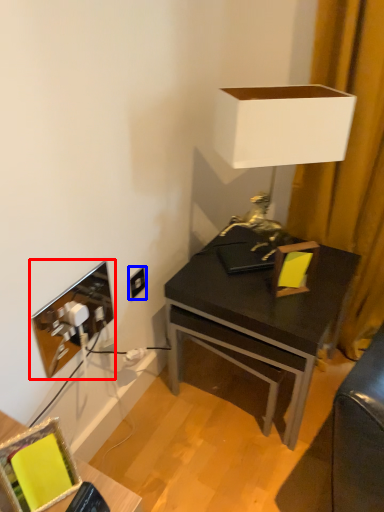
Question: Which point is closer to the camera, picture frame (highlighted by a red box) or power outlet (highlighted by a blue box)?

Choices:
 (A) picture frame
 (B) power outlet

Answer: (A)